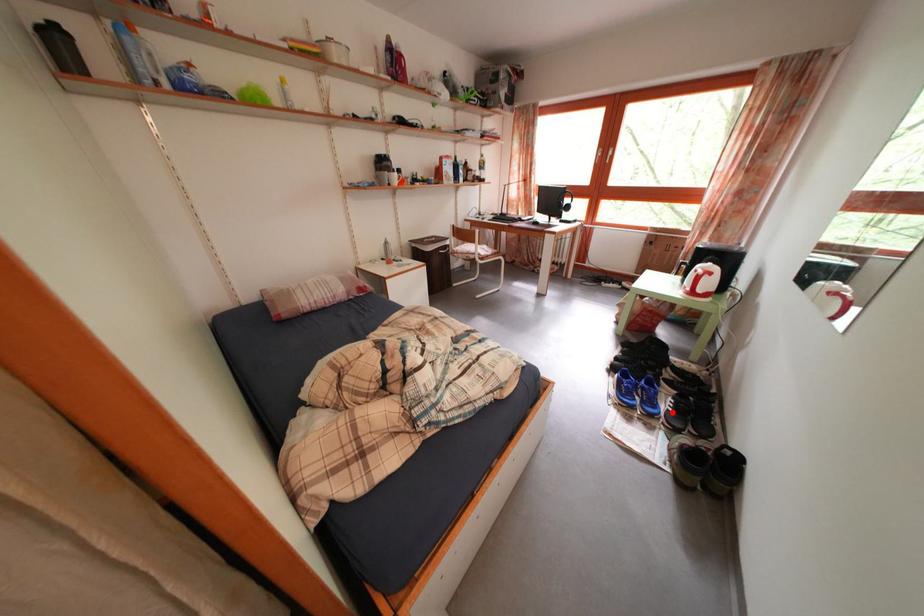
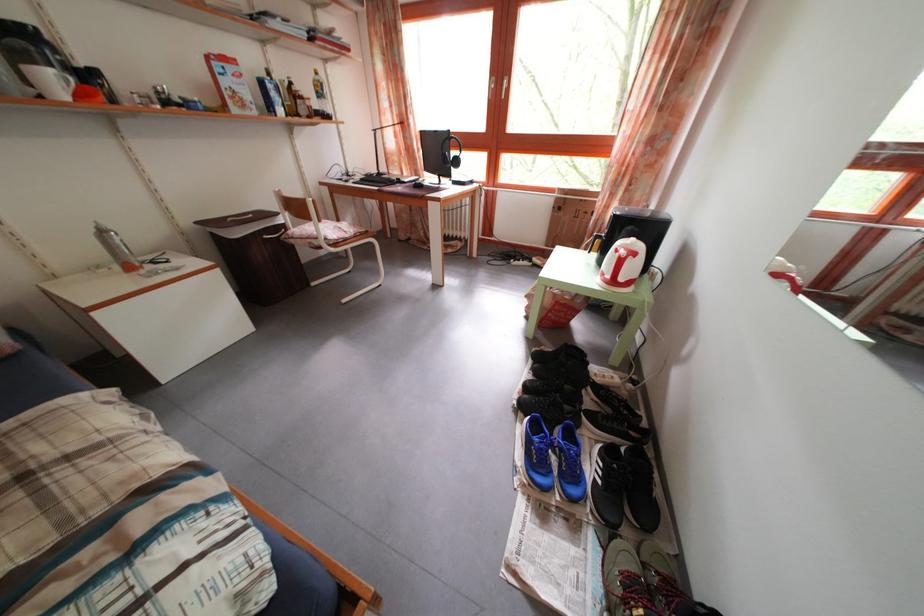
Locate, in the second image, the point that corresponds to the highlighted location in the first image.

(599, 477)